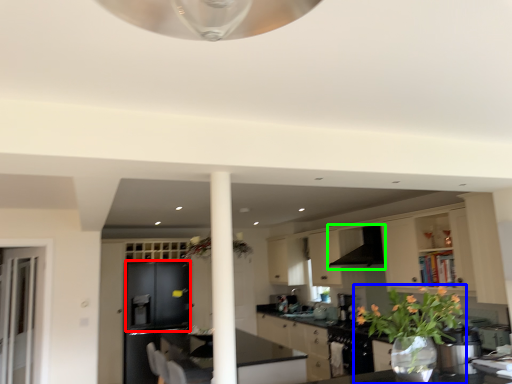
Question: Estimate the real-world distances between objects in this image. Which object is closer to cabinetry (highlighted by a red box), houseplant (highlighted by a blue box) or exhaust hood (highlighted by a green box)?

Choices:
 (A) houseplant
 (B) exhaust hood

Answer: (B)